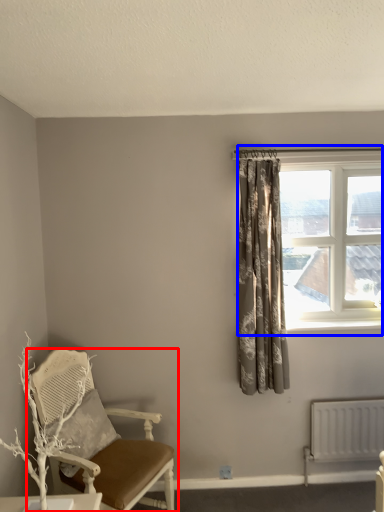
Question: Which object appears closest to the camera in this image, chair (highlighted by a red box) or window (highlighted by a blue box)?

Choices:
 (A) chair
 (B) window

Answer: (A)